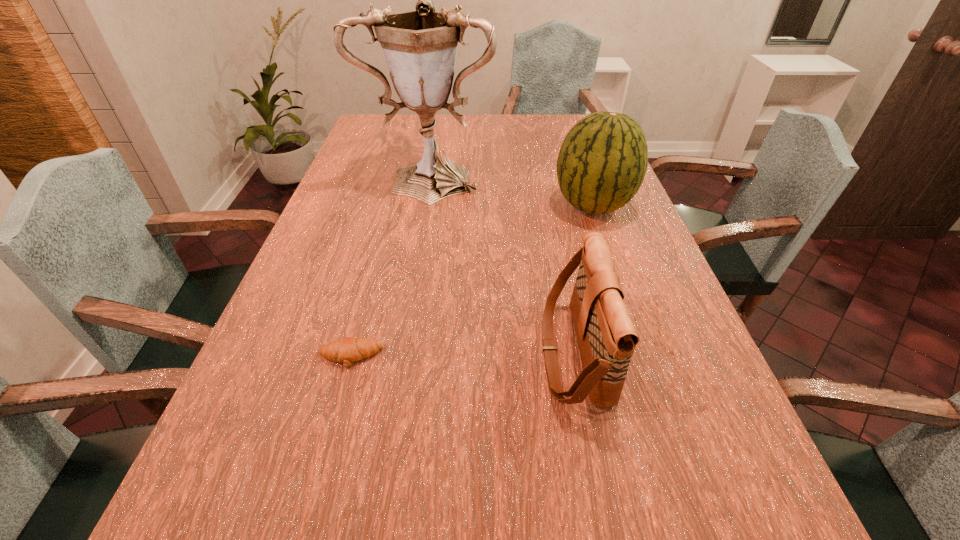
Locate an element on the screen. the tallest object is located at coordinates (420, 47).

Where is `watermelon`? This screenshot has height=540, width=960. watermelon is located at coordinates (602, 162).

The height and width of the screenshot is (540, 960). I want to click on shoulder bag, so click(x=606, y=337).

The image size is (960, 540). Find the location of `the shortest object`. the shortest object is located at coordinates (349, 349).

Where is `free location located 0.320m on the front of the tallest object`? The width and height of the screenshot is (960, 540). free location located 0.320m on the front of the tallest object is located at coordinates (415, 281).

I want to click on free spot located on the left of the watermelon, so click(x=479, y=206).

Where is `free point located 0.140m on the front-facing side of the second shortest object`? The width and height of the screenshot is (960, 540). free point located 0.140m on the front-facing side of the second shortest object is located at coordinates (471, 353).

What are the coordinates of `free point located on the front-facing side of the second shortest object` in the screenshot? It's located at (406, 353).

This screenshot has width=960, height=540. I want to click on free space located on the front-facing side of the second shortest object, so click(x=482, y=353).

This screenshot has width=960, height=540. I want to click on free spot located 0.200m on the front of the shortest object, so click(318, 476).